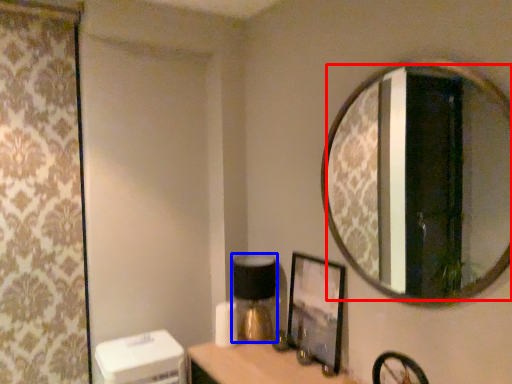
Question: Which object is further to the camera taking this photo, mirror (highlighted by a red box) or table lamp (highlighted by a blue box)?

Choices:
 (A) mirror
 (B) table lamp

Answer: (B)